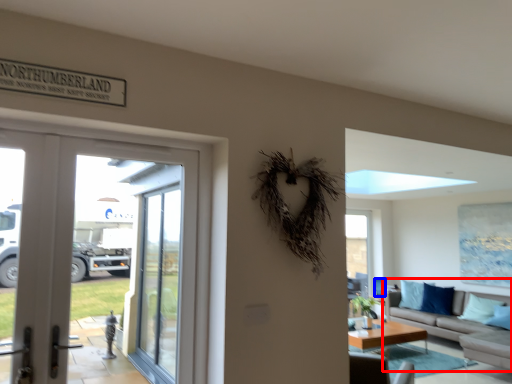
Question: Among these objects, which one is nearest to the camera, studio couch (highlighted by a red box) or armchair (highlighted by a blue box)?

Choices:
 (A) studio couch
 (B) armchair

Answer: (A)